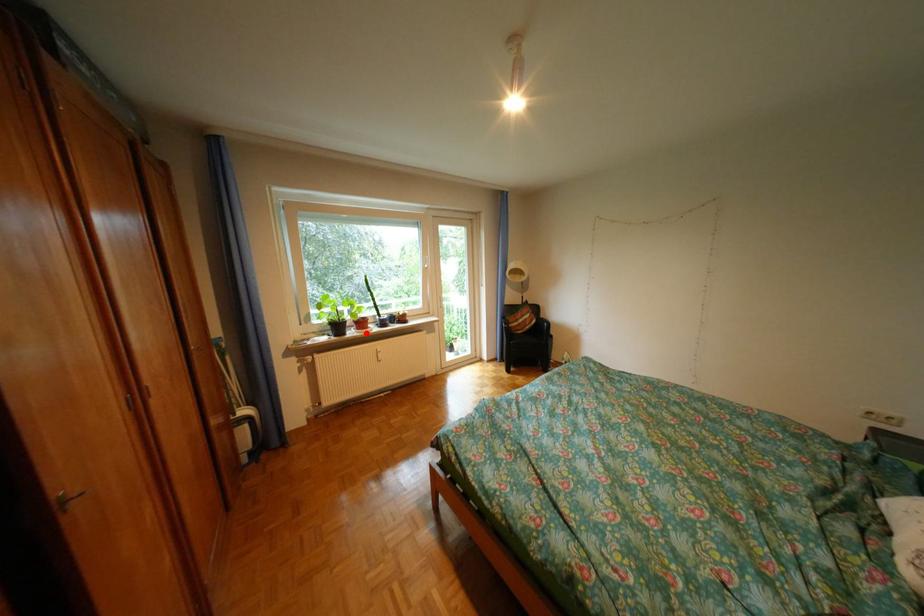
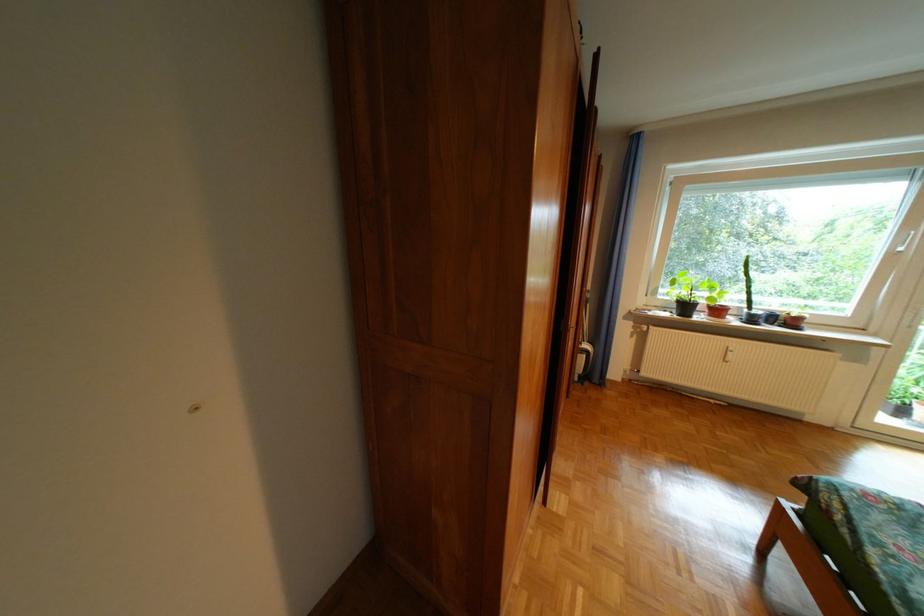
In the second image, find the point that corresponds to the highlighted location in the first image.

(714, 318)